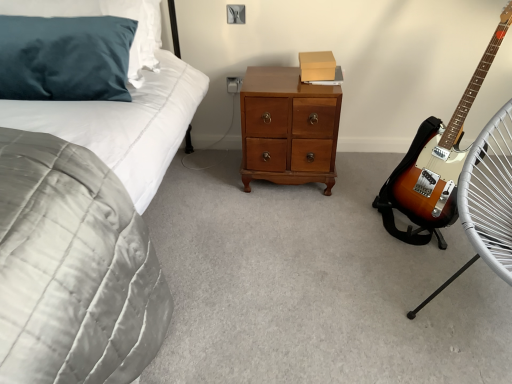
What do you see at coordinates (126, 120) in the screenshot?
I see `velvet grey quilt at left` at bounding box center [126, 120].

At what (x,y) coordinates should I click in order to perform the action: click on teal velvet pillow at upper left. Please return your answer as a coordinate pair (x, y). This screenshot has height=384, width=512. Looking at the image, I should click on (105, 14).

What do you see at coordinates (288, 128) in the screenshot? This screenshot has width=512, height=384. I see `shiny brown wooden chest of drawers at center` at bounding box center [288, 128].

What is the approximate width of white plastic electric outlet at center?

1.38 centimeters.

The width and height of the screenshot is (512, 384). What do you see at coordinates (487, 199) in the screenshot?
I see `satin white folding chair at right` at bounding box center [487, 199].

The height and width of the screenshot is (384, 512). Describe the element at coordinates (442, 153) in the screenshot. I see `satin wood guitar at right` at that location.

Identify the location of velvet grey quilt at left. This screenshot has height=384, width=512. pyautogui.click(x=126, y=120).

Does satin wood guitar at right turn towards velvet grey quilt at left?

Yes, satin wood guitar at right is turned towards velvet grey quilt at left.

Identify the location of guitar behind the velvet grey quilt at left. (442, 153).

Would you say satin wood guitar at right is inside or outside velvet grey quilt at left?

satin wood guitar at right is spatially situated outside velvet grey quilt at left.

Is satin wood guitar at right taller or shorter than velvet grey quilt at left?

satin wood guitar at right is taller than velvet grey quilt at left.

Is satin wood guitar at right in front of or behind satin white folding chair at right in the image?

satin wood guitar at right is positioned farther from the viewer than satin white folding chair at right.

Measure the distance between satin wood guitar at right and satin white folding chair at right.

satin wood guitar at right is 11.16 inches from satin white folding chair at right.

From the image's perspective, is satin wood guitar at right on satin white folding chair at right?

Yes, from the image's perspective, satin wood guitar at right is above satin white folding chair at right.

How many degrees apart are the facing directions of satin wood guitar at right and satin white folding chair at right?

8.73 degrees separate the facing orientations of satin wood guitar at right and satin white folding chair at right.

From the image's perspective, is shiny brown wooden chest of drawers at center on top of velvet grey quilt at left?

Yes.

Which of these two, shiny brown wooden chest of drawers at center or velvet grey quilt at left, is thinner?

Thinner between the two is shiny brown wooden chest of drawers at center.

Is shiny brown wooden chest of drawers at center oriented away from velvet grey quilt at left?

No, shiny brown wooden chest of drawers at center is not facing the opposite direction of velvet grey quilt at left.

Between shiny brown wooden chest of drawers at center and velvet grey quilt at left, which one has larger size?

With larger size is velvet grey quilt at left.

Consider the image. Which object is thinner, teal velvet pillow at upper left or satin white folding chair at right?

teal velvet pillow at upper left.

Considering the positions of objects teal velvet pillow at upper left and satin white folding chair at right in the image provided, who is behind, teal velvet pillow at upper left or satin white folding chair at right?

teal velvet pillow at upper left is more distant.

Does teal velvet pillow at upper left have a greater height compared to satin white folding chair at right?

In fact, teal velvet pillow at upper left may be shorter than satin white folding chair at right.

How many degrees apart are the facing directions of teal velvet pillow at upper left and satin white folding chair at right?

The angular difference between teal velvet pillow at upper left and satin white folding chair at right is 43.7 degrees.

Is satin wood guitar at right bigger than teal velvet pillow at upper left?

Yes.

In the image, is satin wood guitar at right positioned in front of or behind teal velvet pillow at upper left?

satin wood guitar at right is positioned closer to the viewer than teal velvet pillow at upper left.

From the image's perspective, is satin wood guitar at right under teal velvet pillow at upper left?

Yes.

Considering the sizes of objects white plastic electric outlet at center and velvet grey quilt at left in the image provided, who is thinner, white plastic electric outlet at center or velvet grey quilt at left?

white plastic electric outlet at center.

Considering the sizes of objects white plastic electric outlet at center and velvet grey quilt at left in the image provided, who is bigger, white plastic electric outlet at center or velvet grey quilt at left?

With larger size is velvet grey quilt at left.

Would you say white plastic electric outlet at center is outside velvet grey quilt at left?

white plastic electric outlet at center is positioned outside velvet grey quilt at left.

From the image's perspective, is white plastic electric outlet at center beneath velvet grey quilt at left?

Incorrect, from the image's perspective, white plastic electric outlet at center is higher than velvet grey quilt at left.

How distant is velvet grey quilt at left from teal velvet pillow at upper left?

The distance of velvet grey quilt at left from teal velvet pillow at upper left is 5.71 inches.

What's the angular difference between velvet grey quilt at left and teal velvet pillow at upper left's facing directions?

6.18 degrees.

Consider the image. From the image's perspective, is velvet grey quilt at left on teal velvet pillow at upper left?

No.

Based on the photo, considering the positions of objects velvet grey quilt at left and teal velvet pillow at upper left in the image provided, who is more to the right, velvet grey quilt at left or teal velvet pillow at upper left?

velvet grey quilt at left is more to the right.

Locate an element on the screen. Image resolution: width=512 pixels, height=384 pixels. bed lying in front of the satin wood guitar at right is located at coordinates (126, 120).

Find the location of a particular element. This screenshot has width=512, height=384. folding chair lying on the right of satin wood guitar at right is located at coordinates (487, 199).

Estimate the real-world distances between objects in this image. Which object is closer to shiny brown wooden chest of drawers at center, velvet grey quilt at left or satin wood guitar at right?

velvet grey quilt at left is closer to shiny brown wooden chest of drawers at center.

Consider the image. Looking at the image, which one is located closer to teal velvet pillow at upper left, shiny brown wooden chest of drawers at center or white plastic electric outlet at center?

shiny brown wooden chest of drawers at center is closer to teal velvet pillow at upper left.

Considering their positions, is white plastic electric outlet at center positioned closer to velvet grey quilt at left than shiny brown wooden chest of drawers at center?

shiny brown wooden chest of drawers at center lies closer to velvet grey quilt at left than the other object.

From the image, which object appears to be nearer to satin wood guitar at right, velvet grey quilt at left or white plastic electric outlet at center?

white plastic electric outlet at center is positioned closer to the anchor satin wood guitar at right.

Based on their spatial positions, is teal velvet pillow at upper left or velvet grey quilt at left further from satin white folding chair at right?

The object further to satin white folding chair at right is teal velvet pillow at upper left.

When comparing their distances from satin wood guitar at right, does satin white folding chair at right or shiny brown wooden chest of drawers at center seem further?

Based on the image, shiny brown wooden chest of drawers at center appears to be further to satin wood guitar at right.

Considering their positions, is shiny brown wooden chest of drawers at center positioned further to teal velvet pillow at upper left than satin white folding chair at right?

Among the two, satin white folding chair at right is located further to teal velvet pillow at upper left.

Based on their spatial positions, is satin white folding chair at right or white plastic electric outlet at center closer to velvet grey quilt at left?

Among the two, white plastic electric outlet at center is located nearer to velvet grey quilt at left.

Locate an element on the screen. The height and width of the screenshot is (384, 512). chest of drawers between velvet grey quilt at left and white plastic electric outlet at center from front to back is located at coordinates (288, 128).

Find the location of a particular element. This screenshot has width=512, height=384. guitar between satin white folding chair at right and shiny brown wooden chest of drawers at center from front to back is located at coordinates (442, 153).

Where is `folding chair between velvet grey quilt at left and white plastic electric outlet at center from front to back`? Image resolution: width=512 pixels, height=384 pixels. folding chair between velvet grey quilt at left and white plastic electric outlet at center from front to back is located at coordinates (487, 199).

The height and width of the screenshot is (384, 512). In order to click on guitar between velvet grey quilt at left and white plastic electric outlet at center in the front-back direction in this screenshot , I will do `click(442, 153)`.